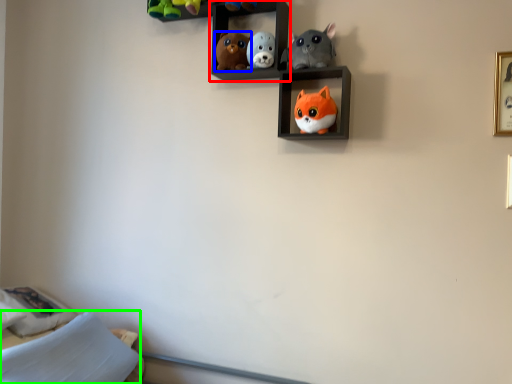
Question: Considering the real-world distances, which object is farthest from shelf (highlighted by a red box)? toy (highlighted by a blue box) or pillow (highlighted by a green box)?

Choices:
 (A) toy
 (B) pillow

Answer: (B)